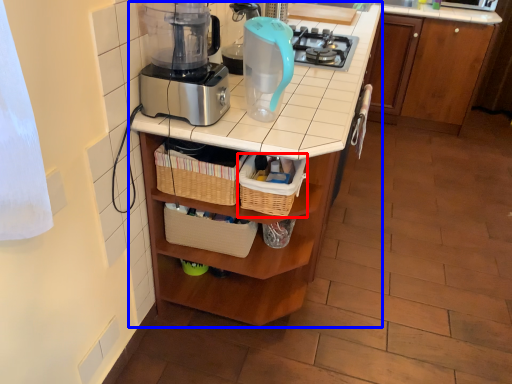
Question: Which of the following is the farthest to the observer, basket (highlighted by a red box) or table (highlighted by a blue box)?

Choices:
 (A) basket
 (B) table

Answer: (A)